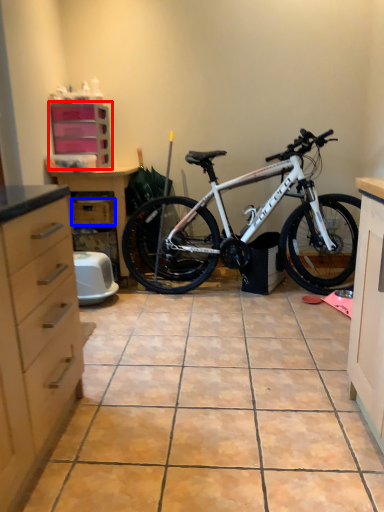
Question: Which object appears farthest to the camera in this image, cabinetry (highlighted by a red box) or drawer (highlighted by a blue box)?

Choices:
 (A) cabinetry
 (B) drawer

Answer: (B)